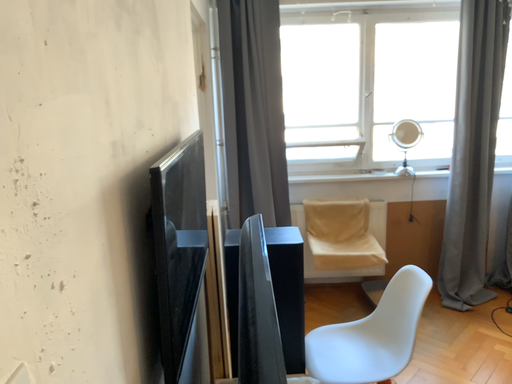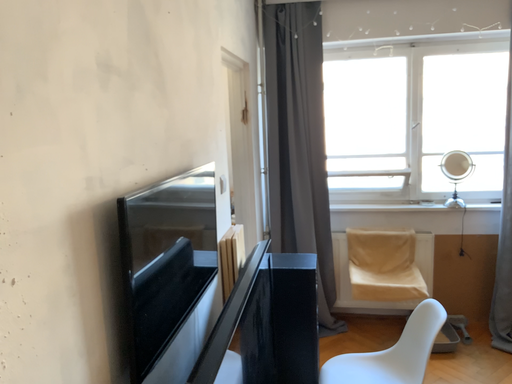
Question: Which way did the camera rotate in the video?

Choices:
 (A) rotated left
 (B) rotated right

Answer: (A)